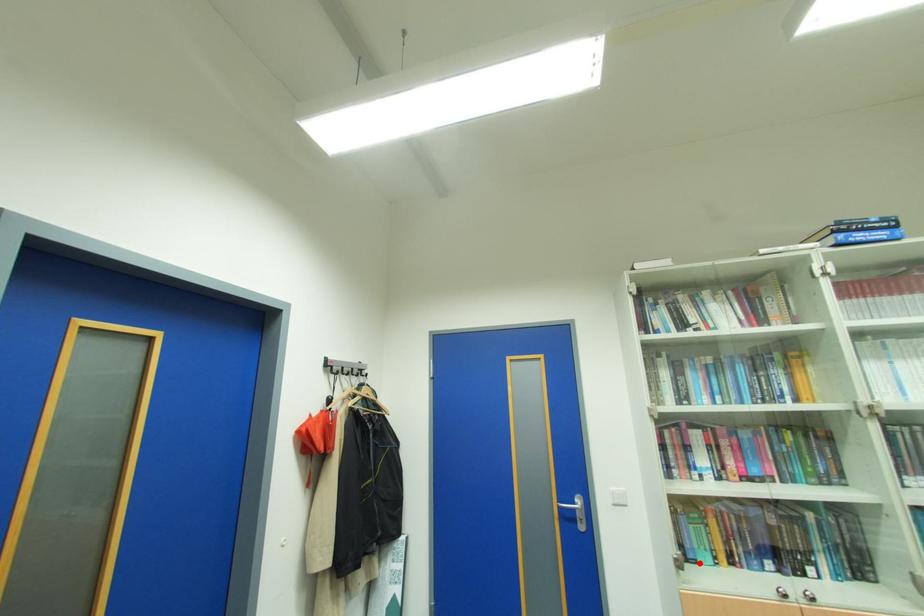
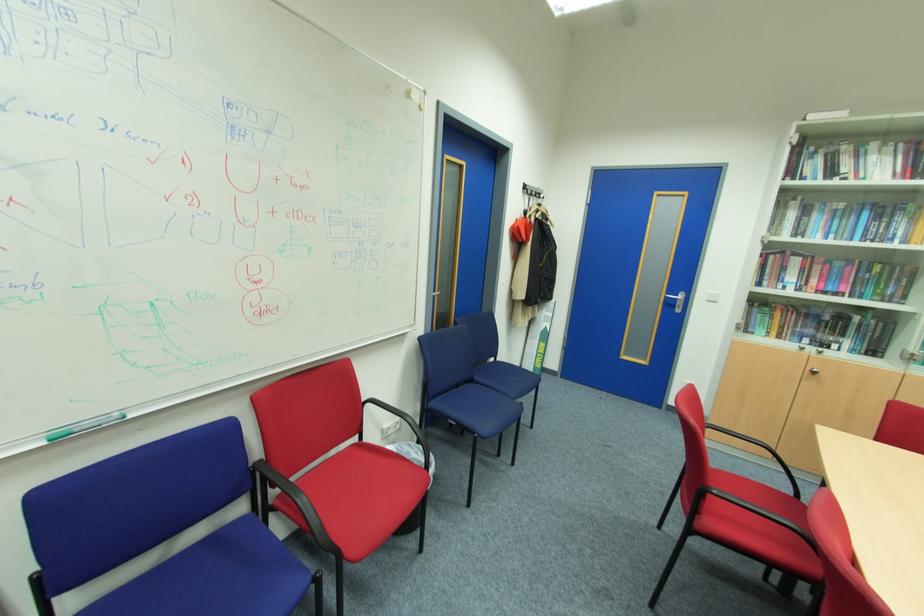
Locate, in the second image, the point that corresponds to the highlighted location in the first image.

(756, 334)